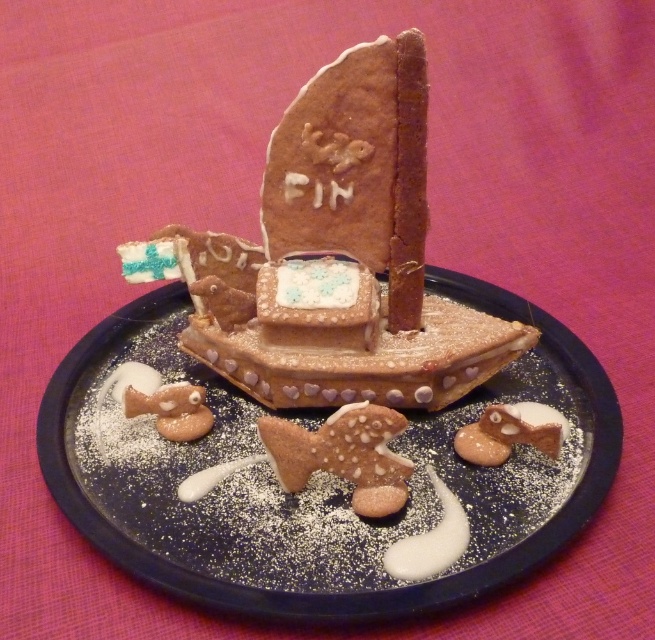
Between point (98, 352) and point (307, 106), which one is positioned behind?

Positioned behind is point (98, 352).

Which is in front, point (267, 600) or point (326, 280)?

Positioned in front is point (267, 600).

Who is more forward, (54, 413) or (356, 100)?

Positioned in front is point (356, 100).

Find the location of `dark blue plate at center`. dark blue plate at center is located at coordinates (320, 477).

Does chocolate cookie boat at center have a smaller size compared to glazed brown fish at center?

Actually, chocolate cookie boat at center might be larger than glazed brown fish at center.

Locate an element on the screen. Image resolution: width=655 pixels, height=640 pixels. chocolate cookie boat at center is located at coordinates (341, 256).

Is dark blue plate at center to the left of glazed brown fish at center from the viewer's perspective?

Indeed, dark blue plate at center is positioned on the left side of glazed brown fish at center.

Can you confirm if dark blue plate at center is bigger than glazed brown fish at center?

Correct, dark blue plate at center is larger in size than glazed brown fish at center.

Find the location of `dark blue plate at center`. dark blue plate at center is located at coordinates (320, 477).